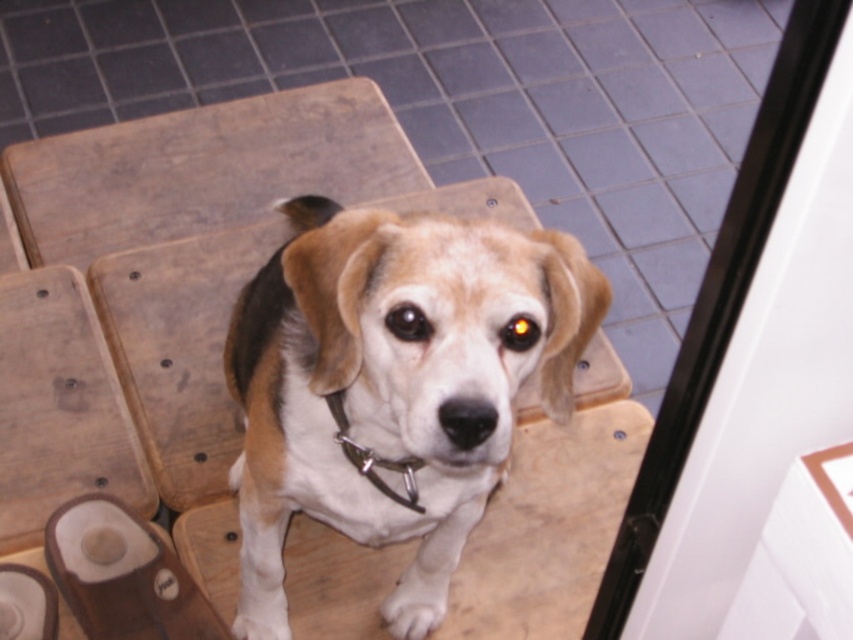
Which is more to the right, transparent glass door at upper right or light brown leather sandal at lower left?

From the viewer's perspective, transparent glass door at upper right appears more on the right side.

I want to click on transparent glass door at upper right, so click(740, 362).

Who is positioned more to the right, light brown leather sandal at lower left or metallic chain at center?

metallic chain at center

Does light brown leather sandal at lower left have a greater height compared to metallic chain at center?

Yes.

This screenshot has width=853, height=640. What do you see at coordinates (123, 576) in the screenshot? I see `light brown leather sandal at lower left` at bounding box center [123, 576].

Locate an element on the screen. This screenshot has height=640, width=853. light brown leather sandal at lower left is located at coordinates (123, 576).

Is brown and white fur dog at center wider than metallic chain at center?

Yes, brown and white fur dog at center is wider than metallic chain at center.

Where is `brown and white fur dog at center`? brown and white fur dog at center is located at coordinates (392, 387).

Locate an element on the screen. This screenshot has width=853, height=640. brown and white fur dog at center is located at coordinates (392, 387).